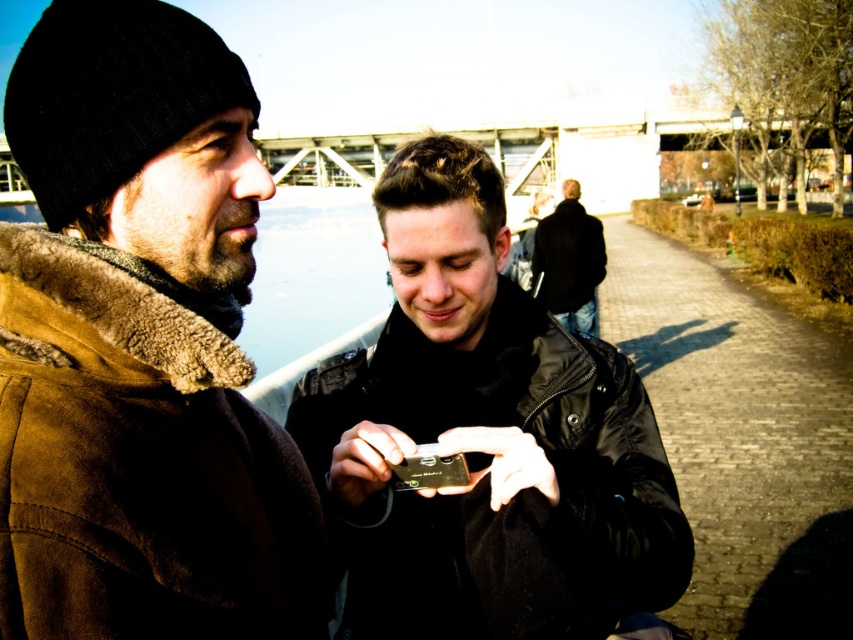
Is suede jacket at left closer to the viewer compared to black leather jacket at center?

Yes, it is in front of black leather jacket at center.

Is suede jacket at left thinner than black leather jacket at center?

Indeed, suede jacket at left has a lesser width compared to black leather jacket at center.

Is point (125, 544) farther from viewer compared to point (570, 243)?

That is False.

You are a GUI agent. You are given a task and a screenshot of the screen. Output one action in this format:
    pyautogui.click(x=<x>, y=<y>)
    Task: Click on the suede jacket at left
    The height and width of the screenshot is (640, 853).
    Given the screenshot: What is the action you would take?
    pyautogui.click(x=138, y=353)

Who is lower down, suede jacket at left or black matte phone at center?

Positioned lower is black matte phone at center.

Who is more forward, (x=248, y=403) or (x=511, y=524)?

Point (x=511, y=524)

Identify the location of suede jacket at left. (138, 353).

From the picture: Can you confirm if black matte phone at center is positioned to the right of black leather jacket at center?

No, black matte phone at center is not to the right of black leather jacket at center.

Who is more forward, (x=453, y=208) or (x=581, y=218)?

Point (x=453, y=208) is more forward.

The width and height of the screenshot is (853, 640). I want to click on black matte phone at center, so click(x=485, y=438).